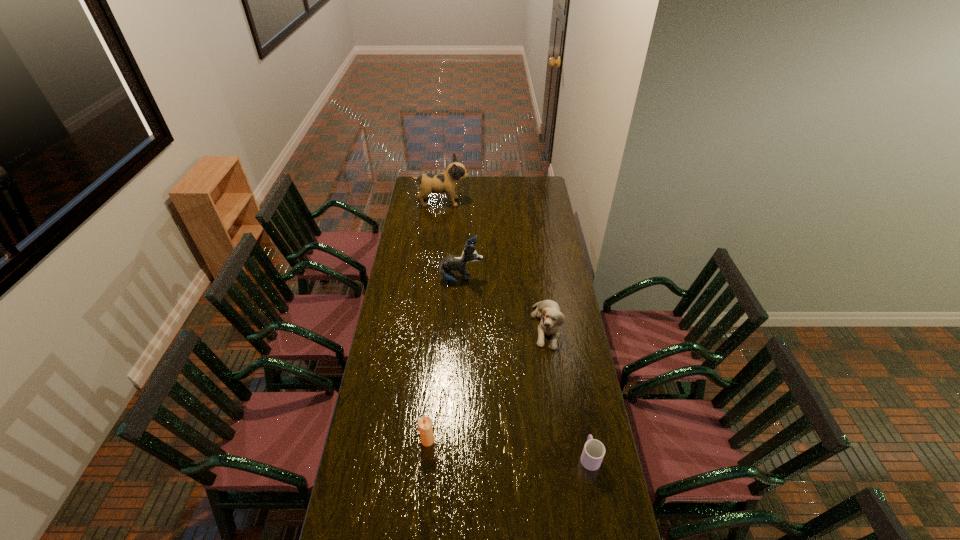
You are a GUI agent. You are given a task and a screenshot of the screen. Output one action in this format:
    pyautogui.click(x=<x>, y=<y>)
    Task: Click on the vacant region at the far edge of the desktop
    
    Given the screenshot: What is the action you would take?
    click(508, 176)

Identify the location of free space at the left edge of the desktop. (413, 224).

At what (x,y) coordinates should I click in order to perform the action: click on vacant space at the right edge of the desktop. Please return your answer as a coordinate pair (x, y). The image size is (960, 540). Looking at the image, I should click on (543, 210).

The image size is (960, 540). What are the coordinates of `vacant space that's between the fourth nearest object and the shortest object` in the screenshot? It's located at (525, 368).

Identify the location of empty space between the shortest object and the rightmost puppy. (568, 391).

Where is `vacant space that is in between the third nearest object and the second tallest object`? This screenshot has height=540, width=960. vacant space that is in between the third nearest object and the second tallest object is located at coordinates (504, 302).

Where is `empty space between the nearest puppy and the shortest object`? Image resolution: width=960 pixels, height=540 pixels. empty space between the nearest puppy and the shortest object is located at coordinates (568, 391).

Select which object appears as the closest to the second nearest puppy. Please provide its 2D coordinates. Your answer should be formatted as a tuple, i.e. [(x, y)], where the tuple contains the x and y coordinates of a point satisfying the conditions above.

[(549, 312)]

Image resolution: width=960 pixels, height=540 pixels. Find the location of `the third closest object to the cup`. the third closest object to the cup is located at coordinates (447, 266).

The height and width of the screenshot is (540, 960). Find the location of `puppy that stands as the closest to the rightmost puppy`. puppy that stands as the closest to the rightmost puppy is located at coordinates (447, 266).